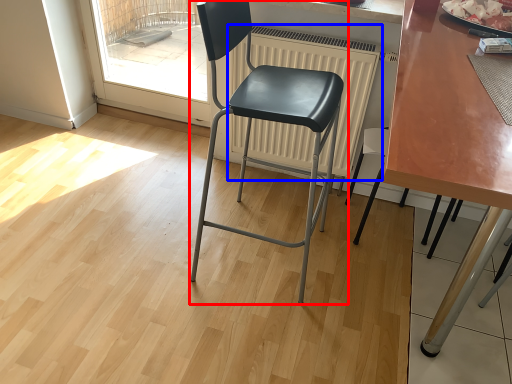
Question: Which object is closer to the camera taking this photo, chair (highlighted by a red box) or radiator (highlighted by a blue box)?

Choices:
 (A) chair
 (B) radiator

Answer: (A)